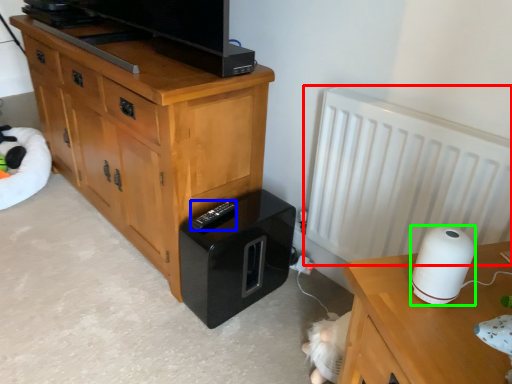
Question: Which is farther away from radiator (highlighted by a red box)? remote (highlighted by a blue box) or appliance (highlighted by a green box)?

Choices:
 (A) remote
 (B) appliance

Answer: (A)